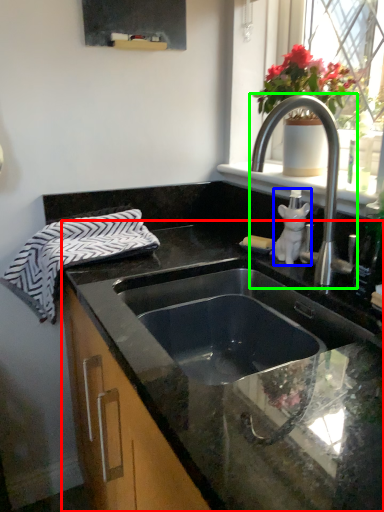
Question: Based on their relative distances, which object is nearer to countertop (highlighted by a red box)? Choose from toiletry (highlighted by a blue box) and tap (highlighted by a green box).

Choices:
 (A) toiletry
 (B) tap

Answer: (B)